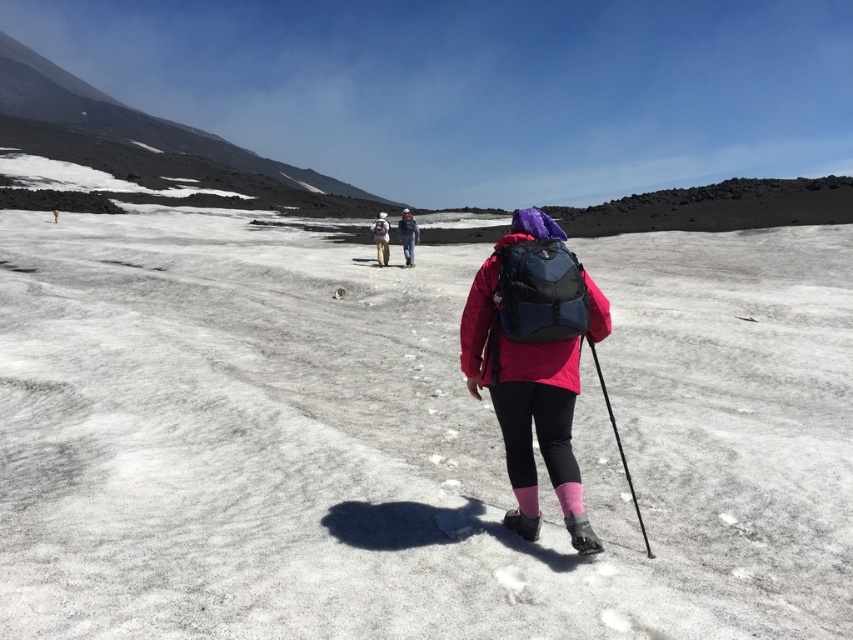
Between point (606, 432) and point (508, 445), which one is positioned in front?

Point (508, 445) is more forward.

Is point (491, 436) closer to camera compared to point (598, 292)?

That is False.

The height and width of the screenshot is (640, 853). In order to click on white snow at center in this screenshot , I will do `click(409, 440)`.

This screenshot has width=853, height=640. In order to click on white snow at center in this screenshot , I will do pyautogui.click(x=409, y=440).

Does white snow at center have a greater width compared to matte gray helmet at center?

Yes.

Is white snow at center to the left of matte gray helmet at center from the viewer's perspective?

No, white snow at center is not to the left of matte gray helmet at center.

Does point (648, 429) come closer to viewer compared to point (399, 234)?

Yes, it is.

Where is `white snow at center`? The height and width of the screenshot is (640, 853). white snow at center is located at coordinates (409, 440).

Who is more forward, [595,355] or [410,259]?

Point [595,355] is more forward.

Is black plastic ski pole at center thinner than matte gray helmet at center?

Correct, black plastic ski pole at center's width is less than matte gray helmet at center's.

The image size is (853, 640). Identify the location of black plastic ski pole at center. (619, 449).